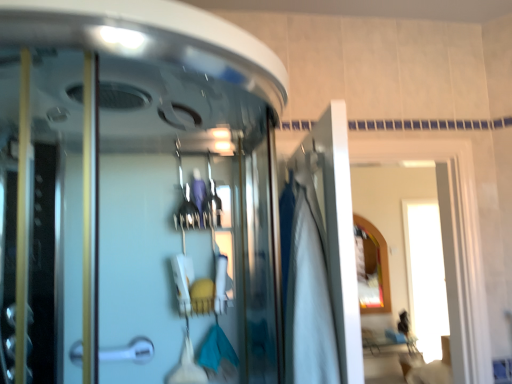
Question: From a real-world perspective, is white fabric at center positioned above or below matte gold mirror at upper right?

Choices:
 (A) below
 (B) above

Answer: (B)

Question: Is white fabric at center wider or thinner than matte gold mirror at upper right?

Choices:
 (A) thin
 (B) wide

Answer: (B)

Question: Which object is the closest to the matte gold mirror at upper right?

Choices:
 (A) white fabric at center
 (B) silver metallic door handle at lower left
 (C) white glossy door at upper right
 (D) transparent glass shower door at center

Answer: (C)

Question: Which object is the farthest from the white glossy door at upper right?

Choices:
 (A) white fabric at center
 (B) silver metallic door handle at lower left
 (C) transparent glass shower door at center
 (D) matte gold mirror at upper right

Answer: (A)